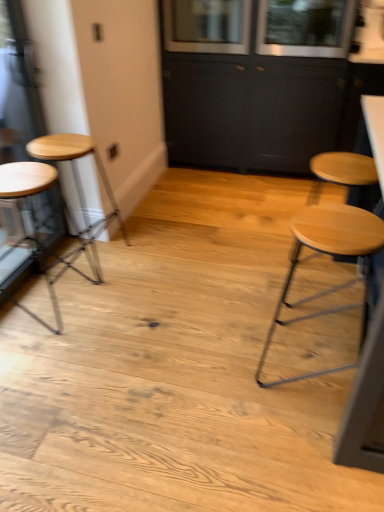
The image size is (384, 512). What are the coordinates of `free location above light wood stool at right, which appears as the first stool when viewed from the right (from a real-world perspective)` in the screenshot? It's located at (334, 225).